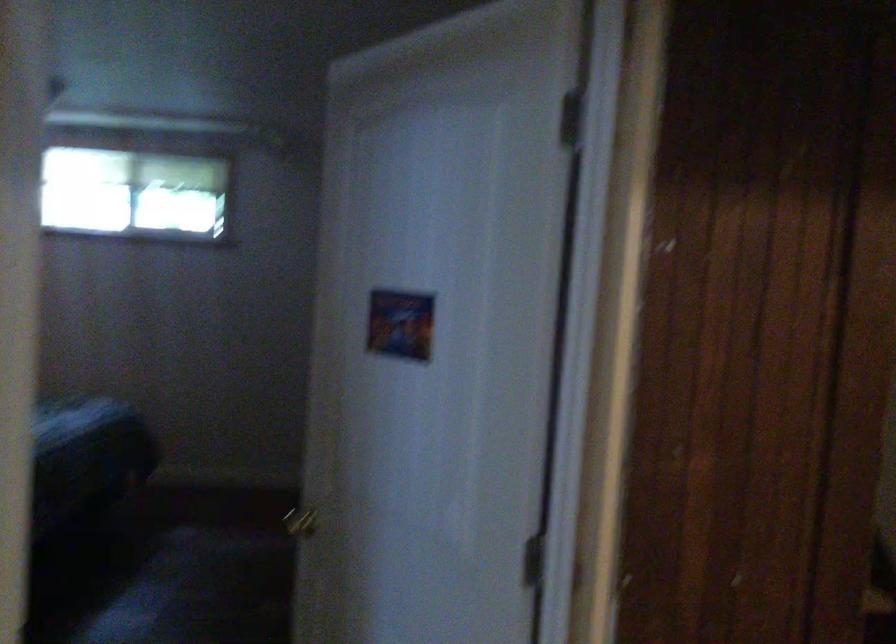
Question: The first image is from the beginning of the video and the second image is from the end. How did the camera likely rotate when shooting the video?

Choices:
 (A) Left
 (B) Right
 (C) Up
 (D) Down

Answer: (B)